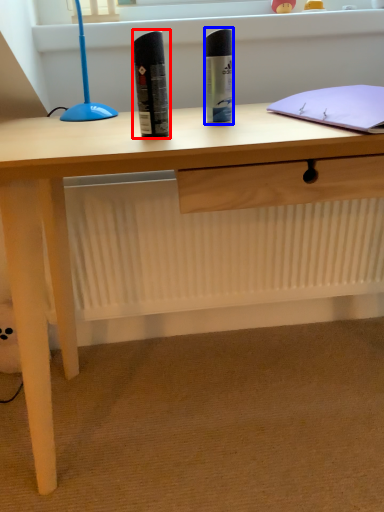
Question: Which of the following is the closest to the observer, stationery (highlighted by a red box) or stationery (highlighted by a blue box)?

Choices:
 (A) stationery
 (B) stationery

Answer: (A)